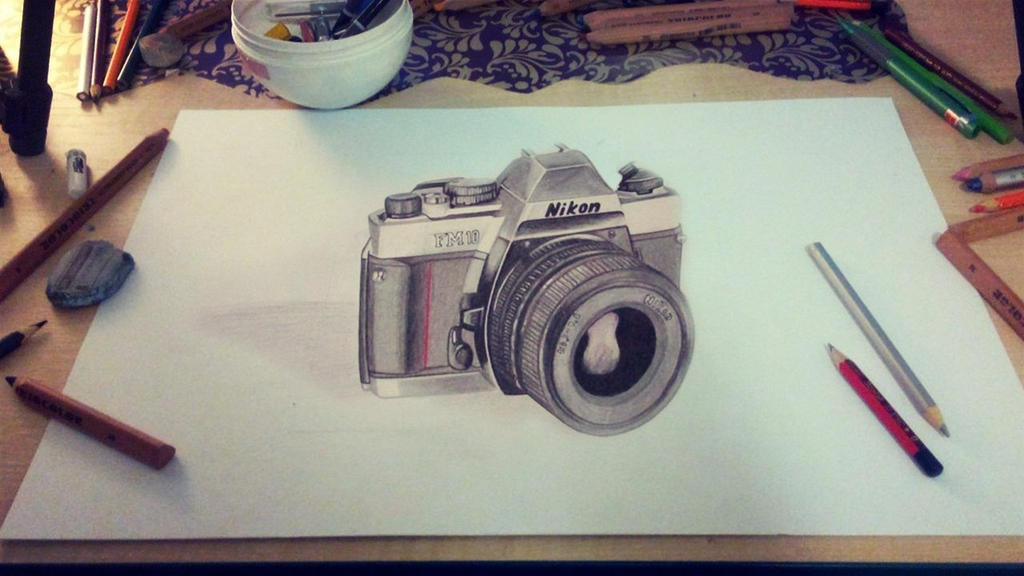
In order to click on table in this screenshot , I will do `click(928, 149)`.